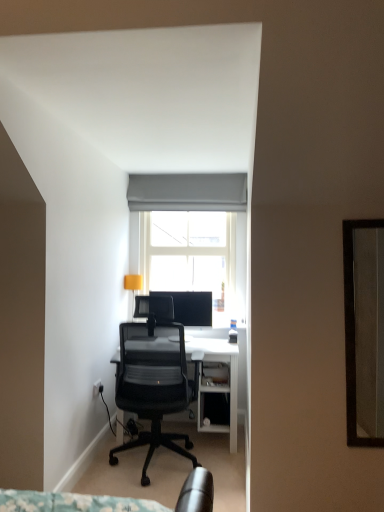
Question: Is gray fabric curtain at upper center wider than matte yellow lampshade at upper left?

Choices:
 (A) yes
 (B) no

Answer: (A)

Question: Could you tell me if gray fabric curtain at upper center is turned towards matte yellow lampshade at upper left?

Choices:
 (A) no
 (B) yes

Answer: (A)

Question: From the image's perspective, is gray fabric curtain at upper center below matte yellow lampshade at upper left?

Choices:
 (A) no
 (B) yes

Answer: (A)

Question: Is gray fabric curtain at upper center beside matte yellow lampshade at upper left?

Choices:
 (A) yes
 (B) no

Answer: (B)

Question: Considering the relative sizes of gray fabric curtain at upper center and matte yellow lampshade at upper left in the image provided, is gray fabric curtain at upper center bigger than matte yellow lampshade at upper left?

Choices:
 (A) yes
 (B) no

Answer: (A)

Question: Considering the relative sizes of gray fabric curtain at upper center and matte yellow lampshade at upper left in the image provided, is gray fabric curtain at upper center thinner than matte yellow lampshade at upper left?

Choices:
 (A) no
 (B) yes

Answer: (A)

Question: Are black mesh office chair at center and matte yellow lampshade at upper left far apart?

Choices:
 (A) no
 (B) yes

Answer: (B)

Question: Is black mesh office chair at center looking in the opposite direction of matte yellow lampshade at upper left?

Choices:
 (A) yes
 (B) no

Answer: (B)

Question: Is black mesh office chair at center with matte yellow lampshade at upper left?

Choices:
 (A) no
 (B) yes

Answer: (A)

Question: Is black mesh office chair at center closer to the viewer compared to matte yellow lampshade at upper left?

Choices:
 (A) no
 (B) yes

Answer: (B)

Question: From the image's perspective, would you say black mesh office chair at center is positioned over matte yellow lampshade at upper left?

Choices:
 (A) no
 (B) yes

Answer: (A)

Question: Is black mesh office chair at center positioned behind matte yellow lampshade at upper left?

Choices:
 (A) no
 (B) yes

Answer: (A)

Question: Considering the relative positions of white glass window at center and black mesh office chair at center in the image provided, is white glass window at center to the right of black mesh office chair at center from the viewer's perspective?

Choices:
 (A) yes
 (B) no

Answer: (A)